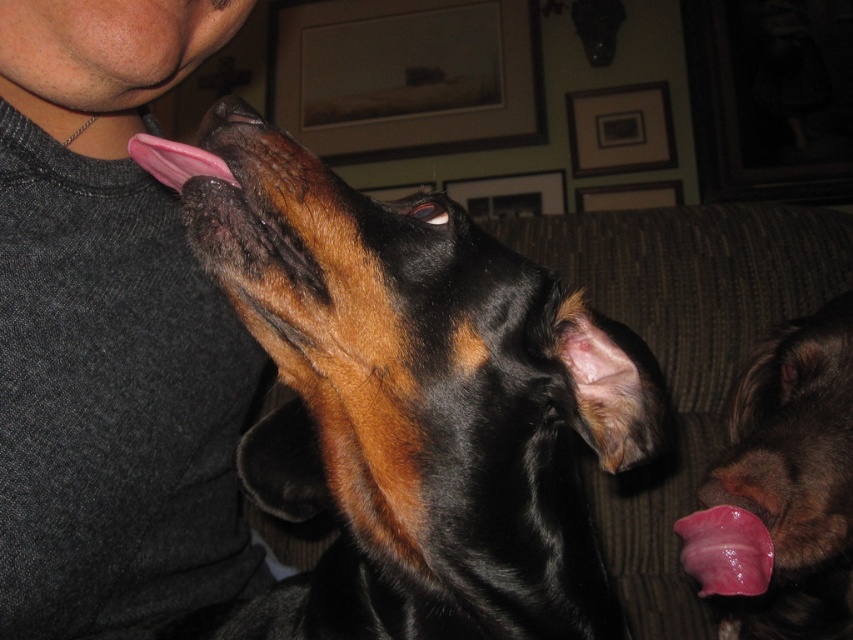
You are a photographer trying to capture a candid shot of the pink glossy tongue at upper left and the gray fabric shirt at left. Do you need to adjust your camera angle to ensure both are fully visible in the frame?

The pink glossy tongue at upper left is behind the gray fabric shirt at left, so you will need to adjust your camera angle to ensure both are fully visible in the frame.

You are a photographer trying to capture a closeup of the black smooth nose at upper center without the pink glossy tongue at lower right overlapping. Based on their sizes, is this possible?

The pink glossy tongue at lower right might be wider than black smooth nose at upper center, so there is a risk of overlap if not positioned carefully.

You are a photographer trying to capture a candid shot of the two tongues in the image. You need to ensure both the pink flesh tongue at lower right and the pink glossy tongue at upper left are in focus. Given that your camera has a depth of field that can cover 15 inches, will both tongues be in focus?

The distance between the pink flesh tongue at lower right and the pink glossy tongue at upper left is 15.28 inches. Since the camera can only cover 15 inches, the tongues are slightly out of the depth of field range. Therefore, both tongues may not be fully in focus.